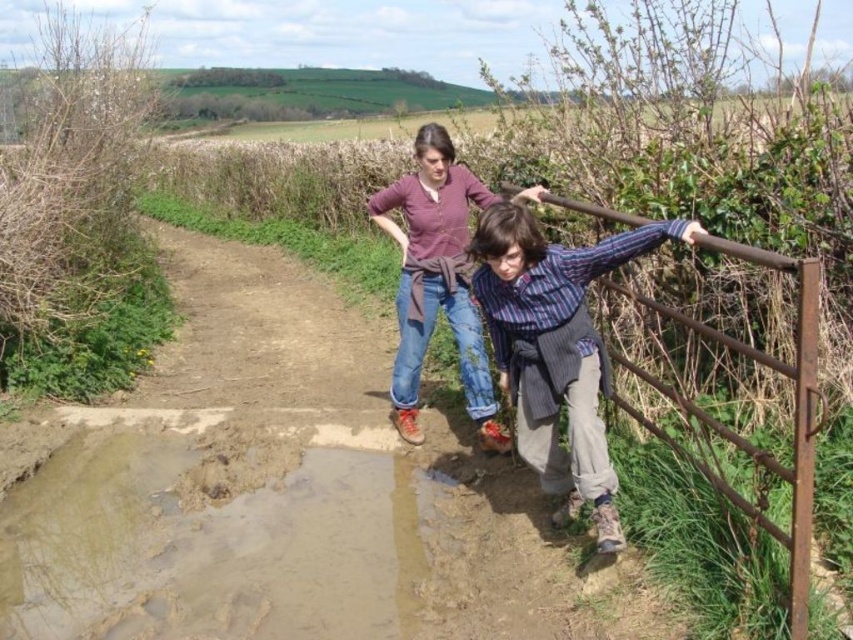
Question: Does matte purple shirt at center appear on the right side of rusty metal gate at right?

Choices:
 (A) yes
 (B) no

Answer: (B)

Question: Considering the relative positions of muddy wet puddle at lower left and rusty metal gate at right in the image provided, where is muddy wet puddle at lower left located with respect to rusty metal gate at right?

Choices:
 (A) below
 (B) above

Answer: (A)

Question: Which object is the closest to the matte purple shirt at center?

Choices:
 (A) striped cotton shirt at right
 (B) muddy wet puddle at lower left

Answer: (A)

Question: Which point appears closest to the camera in this image?

Choices:
 (A) (778, 365)
 (B) (566, 509)
 (C) (436, 252)
 (D) (397, 554)

Answer: (A)

Question: Is striped cotton shirt at right wider than rusty metal gate at right?

Choices:
 (A) yes
 (B) no

Answer: (B)

Question: Which point is closer to the camera?

Choices:
 (A) (563, 348)
 (B) (231, 536)
 (C) (755, 253)
 (D) (454, 296)

Answer: (C)